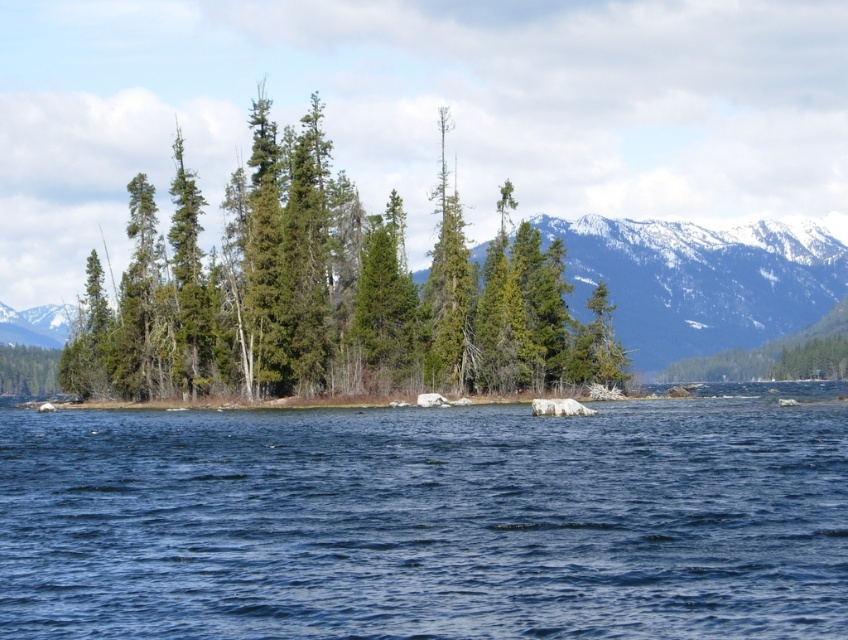
You are standing on the shore looking at the blue liquid water at center and the green matte trees at center. Which object appears taller from your perspective?

The green matte trees at center appear taller than the blue liquid water at center because the description states that the water is not as tall as the trees.